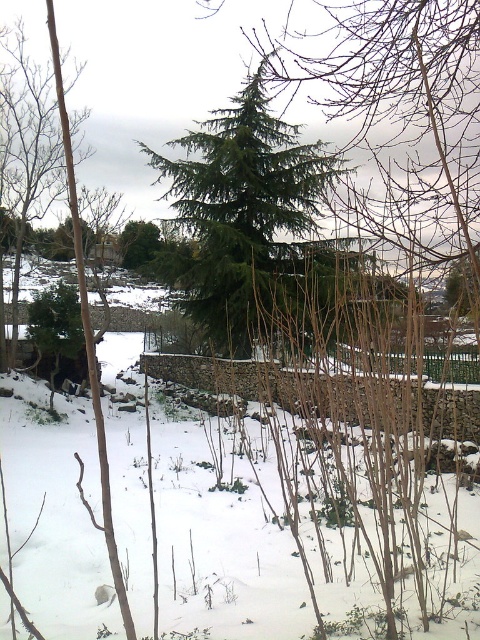
Does brown wood tree at left have a greater height compared to green matte tree at center?

Indeed, brown wood tree at left has a greater height compared to green matte tree at center.

What are the coordinates of `brown wood tree at left` in the screenshot? It's located at (26, 141).

Who is taller, green needle-like tree at center or green wooden fence at center?

With more height is green needle-like tree at center.

Based on the photo, is green needle-like tree at center smaller than green wooden fence at center?

Incorrect, green needle-like tree at center is not smaller in size than green wooden fence at center.

Measure the distance between point [310,195] and camera.

A distance of 53.97 feet exists between point [310,195] and camera.

Where is `green needle-like tree at center`? green needle-like tree at center is located at coordinates (239, 211).

Between stone wall at center and green wooden fence at center, which one appears on the left side from the viewer's perspective?

stone wall at center is more to the left.

This screenshot has height=640, width=480. Find the location of `stone wall at center`. stone wall at center is located at coordinates (332, 394).